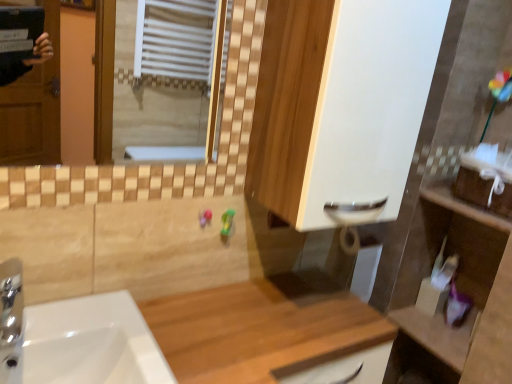
Image resolution: width=512 pixels, height=384 pixels. What are the coordinates of `free space underneath white matte cabinet at center (from a real-world perspective)` in the screenshot? It's located at (301, 300).